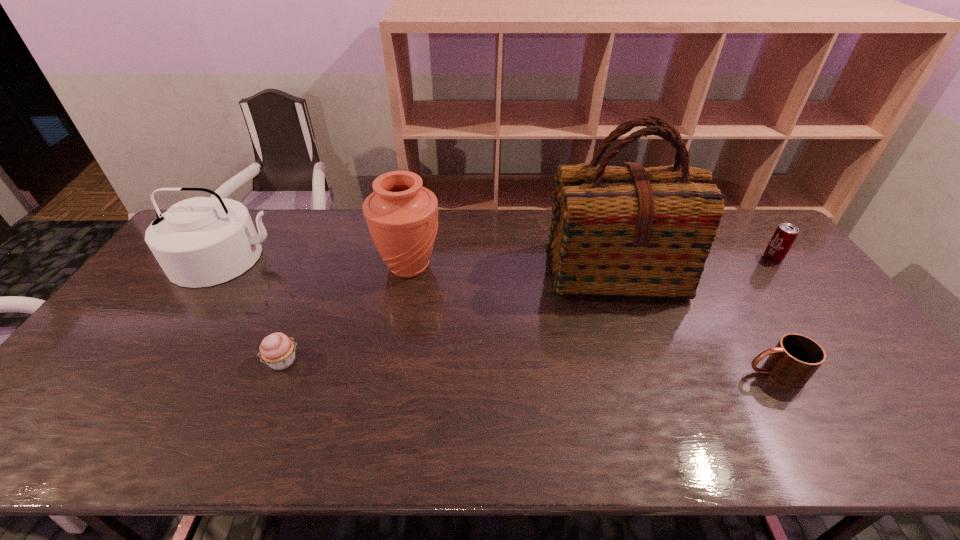
You are a GUI agent. You are given a task and a screenshot of the screen. Output one action in this format:
    pyautogui.click(x=<x>, y=<y>)
    Task: Click on the shopping bag
    Image resolution: width=960 pixels, height=540 pixels.
    Given the screenshot: What is the action you would take?
    pyautogui.click(x=626, y=231)

Where is `the tallest object`? the tallest object is located at coordinates pos(626,231).

Image resolution: width=960 pixels, height=540 pixels. Find the location of `vase`. vase is located at coordinates (402, 216).

The height and width of the screenshot is (540, 960). I want to click on the leftmost object, so click(x=199, y=242).

The image size is (960, 540). I want to click on kettle, so click(199, 242).

Identify the location of the fourth tallest object. The height and width of the screenshot is (540, 960). (785, 234).

The height and width of the screenshot is (540, 960). In order to click on the rightmost object in this screenshot , I will do `click(785, 234)`.

In order to click on cupcake in this screenshot , I will do `click(277, 350)`.

I want to click on mug, so click(x=793, y=361).

At what (x,y) coordinates should I click in order to perform the action: click on vacant region located on the open handle side of the shopping bag. Please return your answer as a coordinate pair (x, y). The width and height of the screenshot is (960, 540). Looking at the image, I should click on (654, 390).